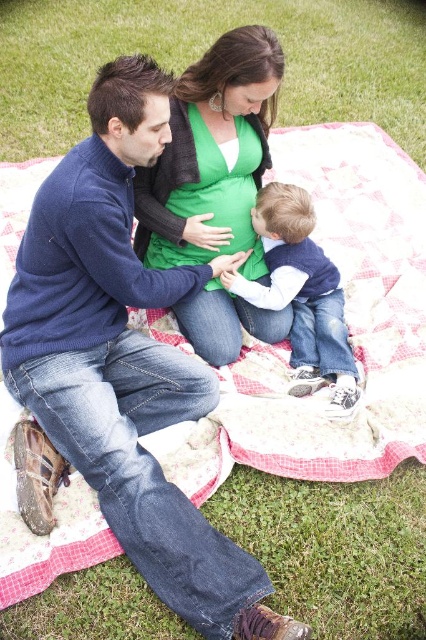
You are a photographer trying to capture a candid shot of the two people wearing the green matte sweater at center and denim jeans at center. Since you want to ensure both subjects are in focus, you need to know which one is taller. Can you determine which is taller?

The green matte sweater at center is much taller than the denim jeans at center, so the photographer should focus on the green matte sweater at center as it is taller.

You are taking a photo of the scene and want to focus on the blue cotton sweater at center and the green matte sweater at center. Which one will appear larger in your photo?

The blue cotton sweater at center will appear larger in the photo because it is closer to the viewer than the green matte sweater at center.

You are a photographer setting up for a group photo. You need to ensure that the blue cotton sweater at center and the green matte sweater at center are at least 18 inches apart for better visibility in the photo. Based on the scene description, is the current distance sufficient?

The distance between the blue cotton sweater at center and the green matte sweater at center is 16.65 inches, which is less than the required 18 inches. Therefore, the current distance is not sufficient for better visibility in the photo.